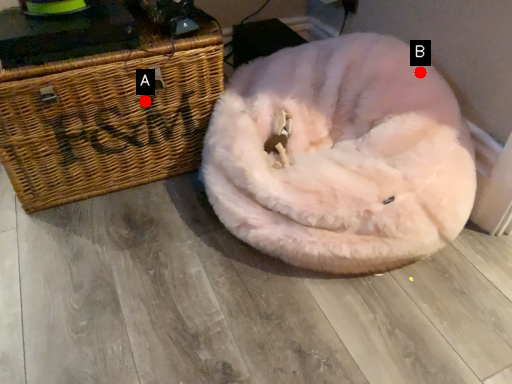
Question: Two points are circled on the image, labeled by A and B beside each circle. Which point is farther from the camera taking this photo?

Choices:
 (A) A is further
 (B) B is further

Answer: (A)